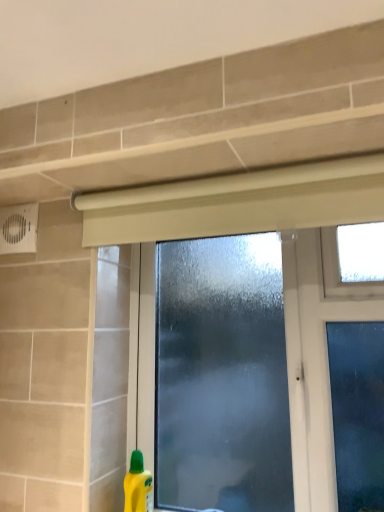
Question: In terms of width, does frosted glass window at center look wider or thinner when compared to yellow plastic bottle at lower left?

Choices:
 (A) thin
 (B) wide

Answer: (A)

Question: Considering their positions, is frosted glass window at center located in front of or behind yellow plastic bottle at lower left?

Choices:
 (A) behind
 (B) front

Answer: (B)

Question: In the image, is frosted glass window at center on the left side or the right side of yellow plastic bottle at lower left?

Choices:
 (A) right
 (B) left

Answer: (A)

Question: From a real-world perspective, is yellow plastic bottle at lower left positioned above or below frosted glass window at center?

Choices:
 (A) below
 (B) above

Answer: (A)

Question: Is yellow plastic bottle at lower left inside or outside of frosted glass window at center?

Choices:
 (A) outside
 (B) inside

Answer: (A)

Question: Is point (139, 472) closer or farther from the camera than point (233, 200)?

Choices:
 (A) farther
 (B) closer

Answer: (A)

Question: In the image, is yellow plastic bottle at lower left positioned in front of or behind frosted glass window at center?

Choices:
 (A) front
 (B) behind

Answer: (B)